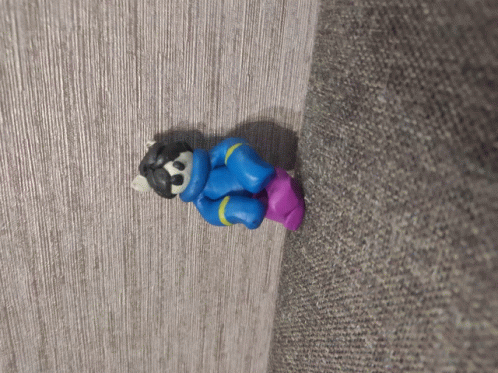
The height and width of the screenshot is (373, 498). Identify the location of carpet. (449, 289).